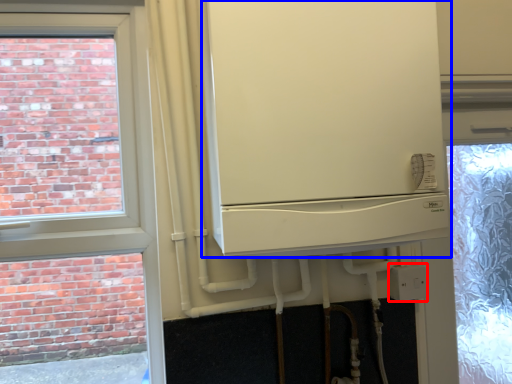
Question: Which object appears farthest to the camera in this image, electric outlet (highlighted by a red box) or fridge (highlighted by a blue box)?

Choices:
 (A) electric outlet
 (B) fridge

Answer: (A)